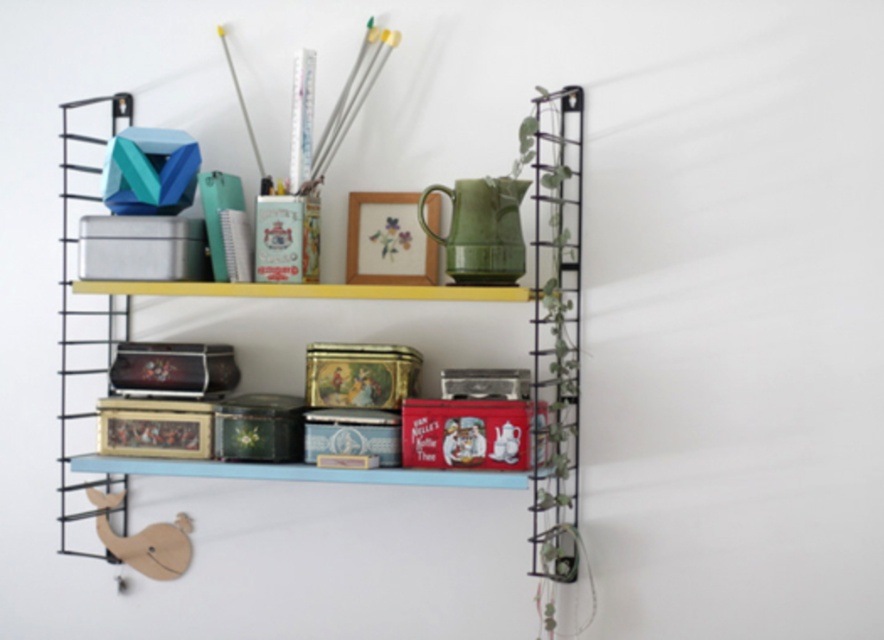
You are standing in front of the wall shelving unit. There is a metallic tin at upper center. Can you estimate its location using coordinates? Please provide the coordinates as a point in the format of x,y.

The metallic tin at upper center is located at coordinates (418, 300).

Please provide the coordinates of the metallic tin at upper center in the image. The coordinates should be given as a point in the format like point (418, 300). The image is a wall mounted shelving unit with yellow top shelf and blue bottom shelf. The top shelf has a geometric object on the left and several cylindrical containers.

The metallic tin at upper center is located at point (418, 300).